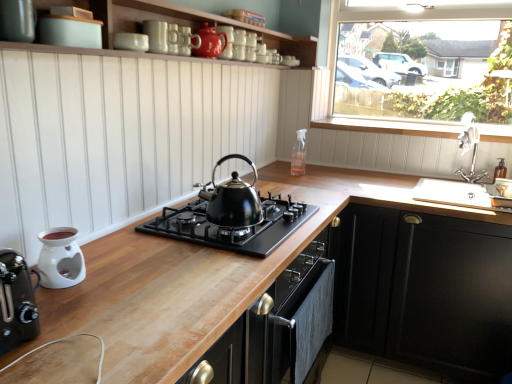
Question: Is white glossy oil burner at lower left, the fourth appliance in the right-to-left sequence, inside black matte cabinet at lower right?

Choices:
 (A) no
 (B) yes

Answer: (A)

Question: Is the depth of black matte cabinet at lower right less than that of white glossy oil burner at lower left, the fourth appliance in the right-to-left sequence?

Choices:
 (A) no
 (B) yes

Answer: (A)

Question: Can you confirm if black matte cabinet at lower right is taller than white glossy oil burner at lower left, the first appliance from the left?

Choices:
 (A) yes
 (B) no

Answer: (A)

Question: Is black matte cabinet at lower right oriented away from white glossy oil burner at lower left, the first appliance from the left?

Choices:
 (A) no
 (B) yes

Answer: (A)

Question: From the image's perspective, is black matte cabinet at lower right on top of white glossy oil burner at lower left, which is the 4th appliance in top-to-bottom order?

Choices:
 (A) yes
 (B) no

Answer: (B)

Question: Is black matte cabinet at lower right aimed at white glossy oil burner at lower left, the first appliance from the left?

Choices:
 (A) no
 (B) yes

Answer: (B)

Question: Is white matte wood shelf at upper center smaller than silver metallic faucet at upper right?

Choices:
 (A) yes
 (B) no

Answer: (B)

Question: From a real-world perspective, is white matte wood shelf at upper center physically below silver metallic faucet at upper right?

Choices:
 (A) yes
 (B) no

Answer: (B)

Question: From the image's perspective, would you say white matte wood shelf at upper center is positioned over silver metallic faucet at upper right?

Choices:
 (A) no
 (B) yes

Answer: (B)

Question: Can you confirm if white matte wood shelf at upper center is taller than silver metallic faucet at upper right?

Choices:
 (A) yes
 (B) no

Answer: (B)

Question: Considering the relative sizes of white matte wood shelf at upper center and silver metallic faucet at upper right in the image provided, is white matte wood shelf at upper center wider than silver metallic faucet at upper right?

Choices:
 (A) yes
 (B) no

Answer: (A)

Question: Is white matte wood shelf at upper center not inside silver metallic faucet at upper right?

Choices:
 (A) no
 (B) yes

Answer: (B)

Question: Considering the relative sizes of silver metallic faucet at upper right and clear glass spray bottle at upper center, which appears as the 1th appliance when viewed from the back, in the image provided, is silver metallic faucet at upper right thinner than clear glass spray bottle at upper center, which appears as the 1th appliance when viewed from the back,?

Choices:
 (A) yes
 (B) no

Answer: (B)